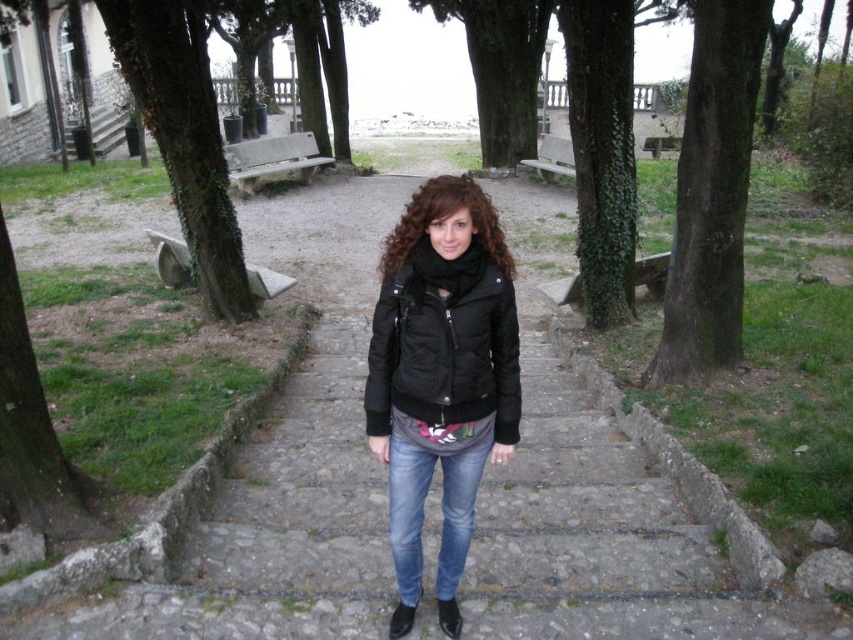
Question: Which object appears farthest from the camera in this image?

Choices:
 (A) green rough bark tree at center
 (B) green rough bark tree at upper center
 (C) denim jeans at center
 (D) black matte jacket at center

Answer: (B)

Question: Considering the real-world distances, which object is farthest from the black quilted jacket at center?

Choices:
 (A) green rough bark tree at left
 (B) denim jeans at center
 (C) green rough bark tree at upper center

Answer: (C)

Question: Does green rough bark tree at center appear over green rough bark tree at upper center?

Choices:
 (A) no
 (B) yes

Answer: (A)

Question: Among these objects, which one is farthest from the camera?

Choices:
 (A) black quilted jacket at center
 (B) black matte jacket at center
 (C) green ivy-covered tree at center-right

Answer: (C)

Question: Can you confirm if green rough bark tree at center is bigger than denim jeans at center?

Choices:
 (A) yes
 (B) no

Answer: (A)

Question: In this image, where is black matte jacket at center located relative to green rough bark tree at left?

Choices:
 (A) right
 (B) left

Answer: (A)